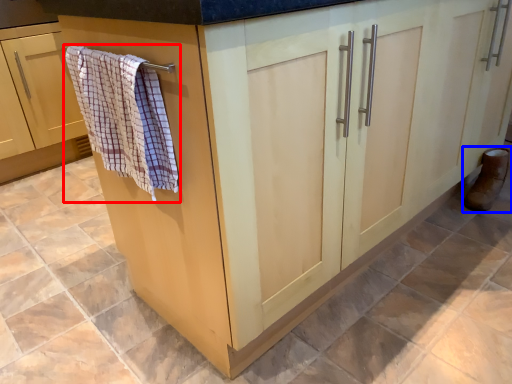
Question: Among these objects, which one is nearest to the camera, bath towel (highlighted by a red box) or footwear (highlighted by a blue box)?

Choices:
 (A) bath towel
 (B) footwear

Answer: (A)